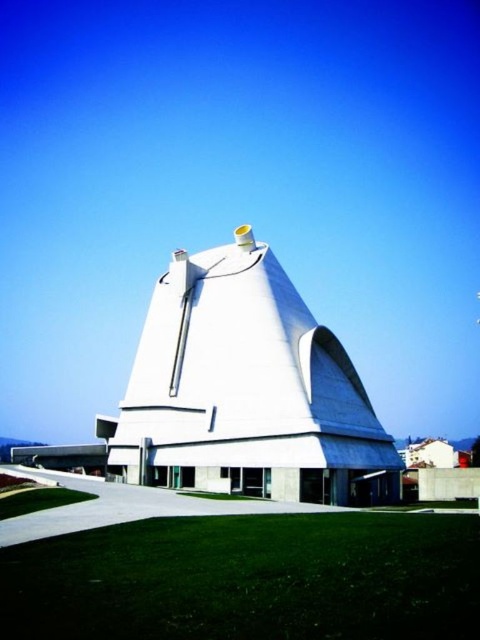
Is green grass at lower center bigger than white concrete building at center?

No.

At what (x,y) coordinates should I click in order to perform the action: click on green grass at lower center. Please return your answer as a coordinate pair (x, y). Image resolution: width=480 pixels, height=640 pixels. Looking at the image, I should click on (249, 579).

Which is behind, point (245, 276) or point (38, 486)?

The point (245, 276) is more distant.

Locate an element on the screen. white concrete building at center is located at coordinates (247, 390).

The width and height of the screenshot is (480, 640). I want to click on white concrete building at center, so click(247, 390).

In the scene shown: Who is positioned more to the right, green grass at lower center or green grass at lower left?

green grass at lower center is more to the right.

Describe the element at coordinates (249, 579) in the screenshot. I see `green grass at lower center` at that location.

Who is more forward, (267, 547) or (47, 488)?

Point (267, 547)

Find the location of a particular element. The image size is (480, 640). green grass at lower center is located at coordinates [x=249, y=579].